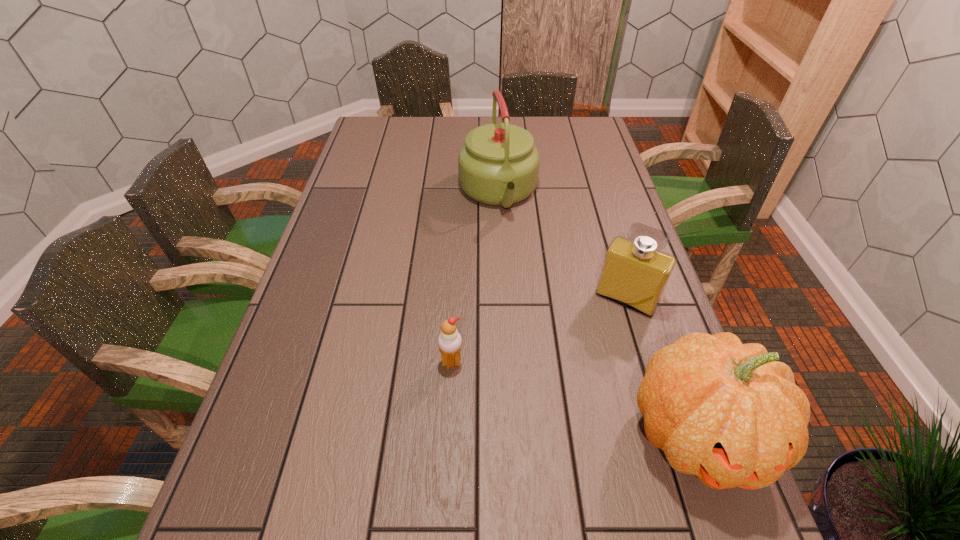
Where is `vacant space located at the spout of the farthest object`? The width and height of the screenshot is (960, 540). vacant space located at the spout of the farthest object is located at coordinates (526, 298).

Find the location of a particular element. free space located at the spout of the farthest object is located at coordinates (517, 265).

Where is `vacant space located 0.120m at the spout of the farthest object`? The image size is (960, 540). vacant space located 0.120m at the spout of the farthest object is located at coordinates (514, 253).

You are a GUI agent. You are given a task and a screenshot of the screen. Output one action in this format:
    pyautogui.click(x=<x>, y=<y>)
    Task: Click on the object that is at the near edge
    This screenshot has height=540, width=960.
    Given the screenshot: What is the action you would take?
    pyautogui.click(x=729, y=413)

Identify the location of pumpkin situated at the right edge. (729, 413).

Where is `perfume present at the right edge`? Image resolution: width=960 pixels, height=540 pixels. perfume present at the right edge is located at coordinates (635, 272).

Find the location of a particular element. This screenshot has height=540, width=960. object positioned at the near right corner is located at coordinates (729, 413).

You are a GUI agent. You are given a task and a screenshot of the screen. Output one action in this format:
    pyautogui.click(x=<x>, y=<y>)
    Task: Click on the vacant space at the far edge
    The width and height of the screenshot is (960, 540).
    Given the screenshot: What is the action you would take?
    pyautogui.click(x=451, y=144)

Where is `vacant space at the left edge`? The image size is (960, 540). vacant space at the left edge is located at coordinates (307, 328).

The width and height of the screenshot is (960, 540). What are the coordinates of `vacant area at the right edge of the desktop` in the screenshot? It's located at (586, 188).